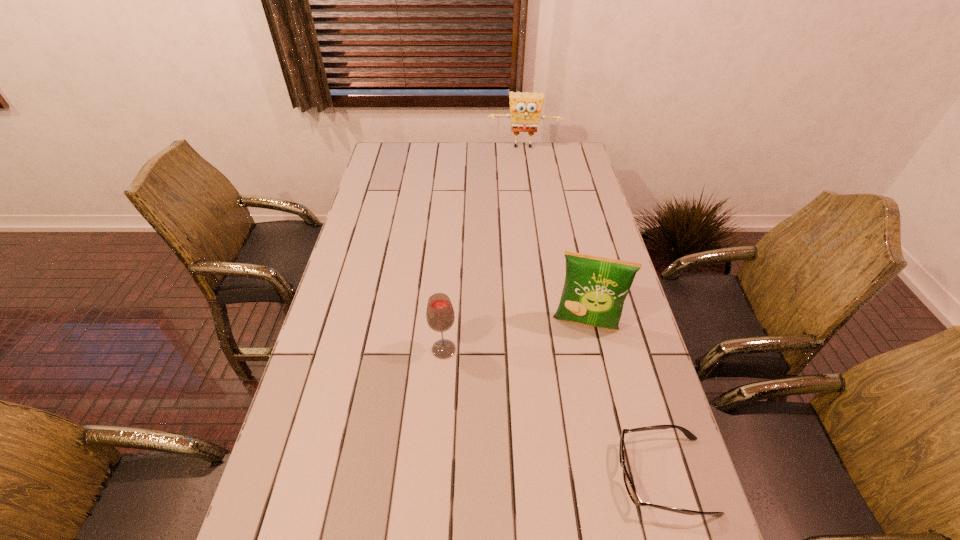
You are a GUI agent. You are given a task and a screenshot of the screen. Output one action in this format:
    pyautogui.click(x=<x>, y=<y>)
    Task: Click on the vacant area that lies between the shortest object and the third nearest object
    
    Given the screenshot: What is the action you would take?
    pyautogui.click(x=624, y=400)

Find the location of a particular element. This screenshot has height=540, width=960. free space between the second farthest object and the nearest object is located at coordinates (624, 400).

Locate an element on the screen. free space between the farthest object and the third nearest object is located at coordinates (554, 236).

Locate an element on the screen. The height and width of the screenshot is (540, 960). blank region between the nearest object and the crisp (potato chip) is located at coordinates (624, 400).

I want to click on vacant region between the third farthest object and the shortest object, so click(x=554, y=413).

Locate an element on the screen. The width and height of the screenshot is (960, 540). vacant area that lies between the third farthest object and the second farthest object is located at coordinates (515, 337).

Where is `blank region between the glass drink container and the nearest object`? The width and height of the screenshot is (960, 540). blank region between the glass drink container and the nearest object is located at coordinates (554, 413).

Find the location of a particular element. Image resolution: width=960 pixels, height=540 pixels. vacant area between the leftmost object and the sponge is located at coordinates (484, 248).

I want to click on object that is the nearest to the leftmost object, so click(595, 288).

At what (x,y) coordinates should I click in order to perform the action: click on object that is the second closest one to the nearest object. Please return your answer as a coordinate pair (x, y). Looking at the image, I should click on (440, 316).